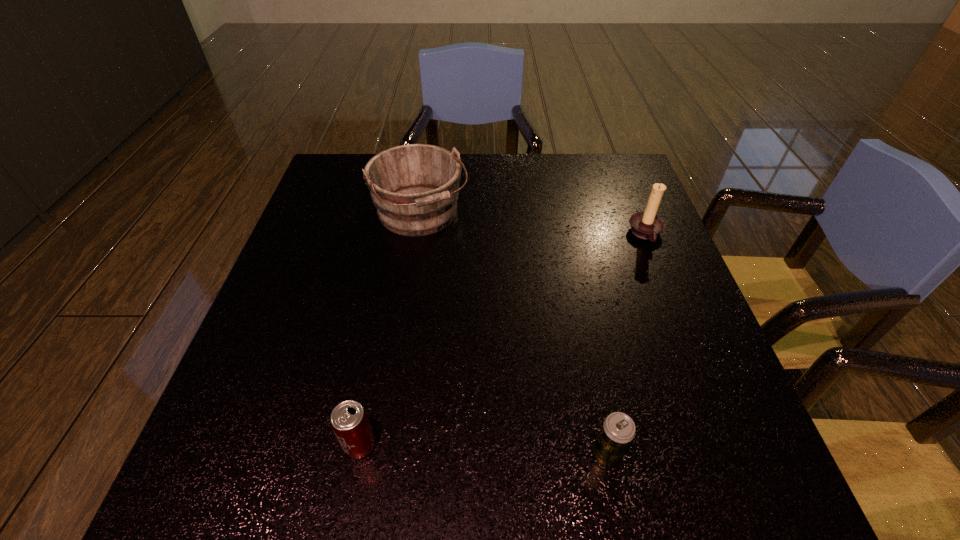
I want to click on object that is at the far edge, so click(x=415, y=188).

Where is `object present at the right edge`? This screenshot has height=540, width=960. object present at the right edge is located at coordinates (647, 225).

In the image, there is a desktop. Where is `blank space at the far edge`? This screenshot has width=960, height=540. blank space at the far edge is located at coordinates [x=572, y=178].

You are a GUI agent. You are given a task and a screenshot of the screen. Output one action in this format:
    pyautogui.click(x=<x>, y=<y>)
    Task: Click on the free point at the near edge
    The height and width of the screenshot is (540, 960).
    Given the screenshot: What is the action you would take?
    pyautogui.click(x=320, y=476)

Where is `vacant space at the left edge of the desktop`? This screenshot has height=540, width=960. vacant space at the left edge of the desktop is located at coordinates 290,315.

In the image, there is a desktop. Identify the location of vacant space at the right edge. (756, 452).

Where is `vacant space at the far left corner of the desktop`? The width and height of the screenshot is (960, 540). vacant space at the far left corner of the desktop is located at coordinates (354, 183).

At what (x,y) coordinates should I click in order to perform the action: click on free location at the near left corner. Please return your answer as a coordinate pair (x, y). The image size is (960, 540). Looking at the image, I should click on (270, 488).

I want to click on free space at the far right corner, so click(x=588, y=176).

What are the coordinates of `unoccupied area between the left beer can and the third object from left to right` in the screenshot? It's located at (484, 450).